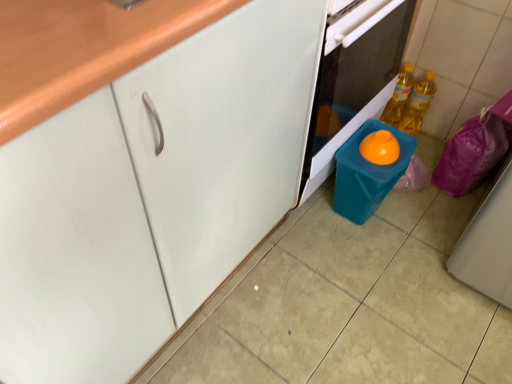
Locate an element on the screen. Image resolution: width=512 pixels, height=384 pixels. blank space above teal plastic container at lower right (from a real-world perspective) is located at coordinates (378, 154).